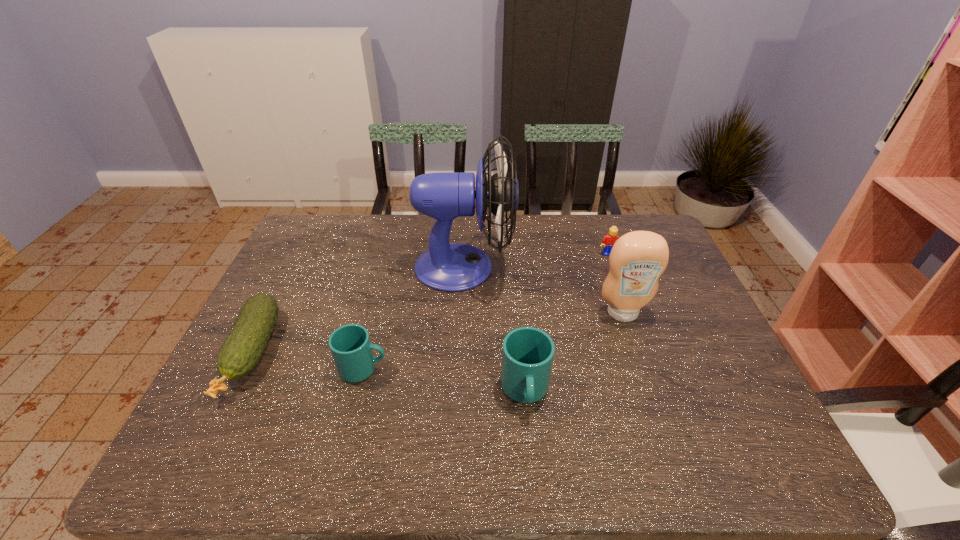
Locate an element on the screen. the left cup is located at coordinates (350, 345).

The height and width of the screenshot is (540, 960). Identify the location of the fifth object from right to left. (350, 345).

You are a GUI agent. You are given a task and a screenshot of the screen. Output one action in this format:
    pyautogui.click(x=<x>, y=<y>)
    Task: Click on the fourth shortest object
    This screenshot has width=960, height=540.
    Given the screenshot: What is the action you would take?
    pyautogui.click(x=527, y=356)

At what (x,y) coordinates should I click in order to perform the action: click on the taller cup. Please return your answer as a coordinate pair (x, y). This screenshot has width=960, height=540. Looking at the image, I should click on (527, 356).

This screenshot has width=960, height=540. What are the coordinates of `Lego` in the screenshot? It's located at (608, 241).

Locate an element on the screen. the second tallest object is located at coordinates (638, 258).

Locate an element on the screen. The image size is (960, 540). fan is located at coordinates (454, 267).

Where is `cucumber`? cucumber is located at coordinates (241, 351).

Locate an element on the screen. The width and height of the screenshot is (960, 540). the leftmost object is located at coordinates 241,351.

This screenshot has height=540, width=960. What are the coordinates of `free space located on the handle side of the shorter cup` in the screenshot? It's located at pos(444,369).